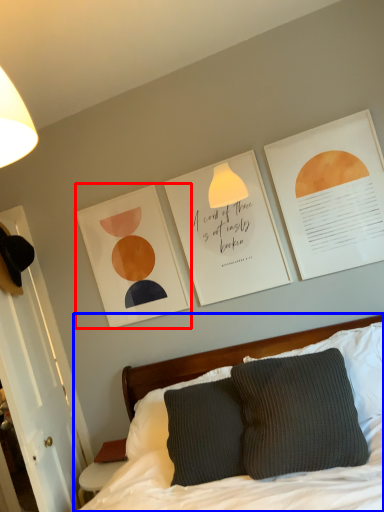
Question: Which object appears closest to the camera in this image, picture frame (highlighted by a red box) or bed (highlighted by a blue box)?

Choices:
 (A) picture frame
 (B) bed

Answer: (B)